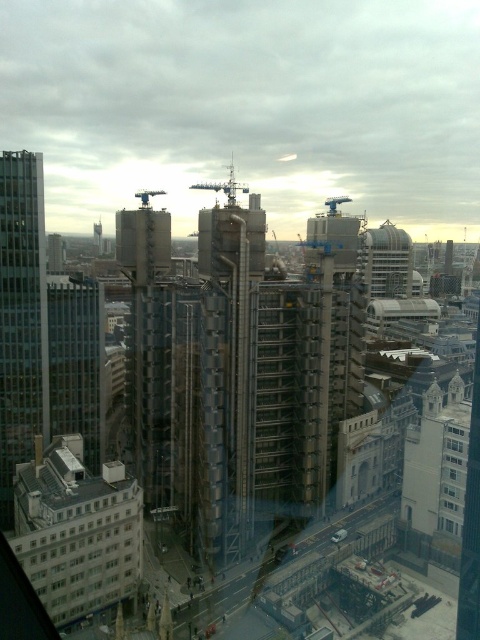
Can you confirm if clear glass window at lower left is wider than clear glass windows at center?

Indeed, clear glass window at lower left has a greater width compared to clear glass windows at center.

Who is more distant from viewer, (83, 540) or (460, 420)?

The point (460, 420) is more distant.

At what (x,y) coordinates should I click in order to perform the action: click on clear glass window at lower left. Please return your answer as a coordinate pair (x, y). Looking at the image, I should click on (84, 560).

Which is below, clear glass window at lower left or glassy steel tower at upper right?

Positioned lower is clear glass window at lower left.

Does point (68, 582) come closer to viewer compared to point (410, 262)?

Yes, it is in front of point (410, 262).

At what (x,y) coordinates should I click in order to perform the action: click on clear glass window at lower left. Please return your answer as a coordinate pair (x, y). The height and width of the screenshot is (640, 480). Looking at the image, I should click on (84, 560).

From the picture: Can you confirm if glassy steel tower at upper right is bigger than metallic gray crane at center?

No, glassy steel tower at upper right is not bigger than metallic gray crane at center.

Locate an element on the screen. The image size is (480, 640). glassy steel tower at upper right is located at coordinates (385, 260).

Where is `glassy steel tower at upper right`? glassy steel tower at upper right is located at coordinates (385, 260).

Where is `glassy steel tower at upper right`? glassy steel tower at upper right is located at coordinates (385, 260).